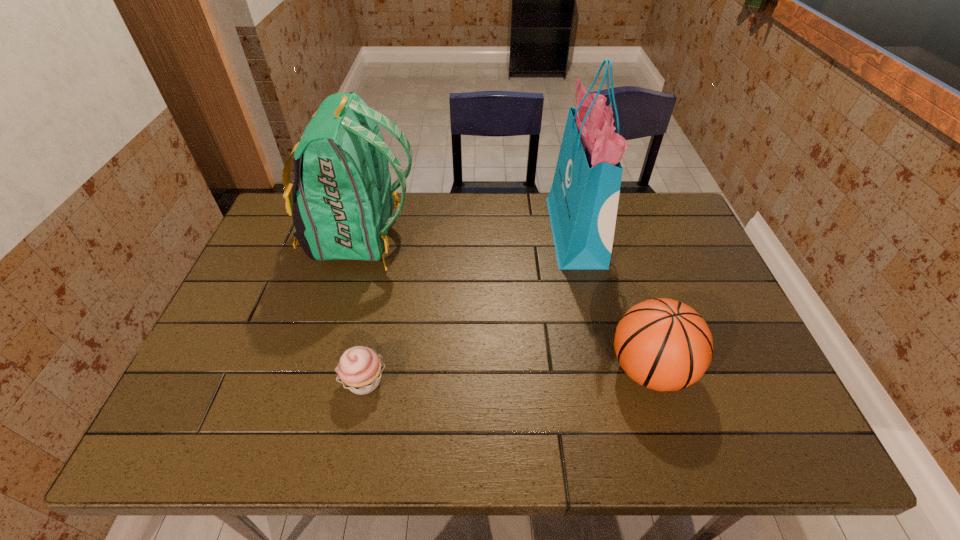
This screenshot has height=540, width=960. Find the location of `shopping bag`. shopping bag is located at coordinates (583, 201).

Locate an element on the screen. This screenshot has width=960, height=540. backpack is located at coordinates (341, 201).

Locate an element on the screen. The height and width of the screenshot is (540, 960). basketball is located at coordinates (665, 345).

I want to click on the shortest object, so click(x=360, y=368).

The height and width of the screenshot is (540, 960). What are the coordinates of `vacant space located on the right of the shopping bag` in the screenshot? It's located at (614, 233).

The width and height of the screenshot is (960, 540). Find the location of `free space located 0.080m on the back of the second tallest object`. free space located 0.080m on the back of the second tallest object is located at coordinates [x=443, y=237].

I want to click on vacant space positioned on the back of the basketball, so click(x=610, y=241).

Locate an element on the screen. The width and height of the screenshot is (960, 540). vacant space situated 0.210m on the right of the cupcake is located at coordinates (479, 381).

The width and height of the screenshot is (960, 540). Find the location of `shopping bag situated at the far edge`. shopping bag situated at the far edge is located at coordinates (583, 201).

Locate an element on the screen. The width and height of the screenshot is (960, 540). backpack located at the far edge is located at coordinates (341, 201).